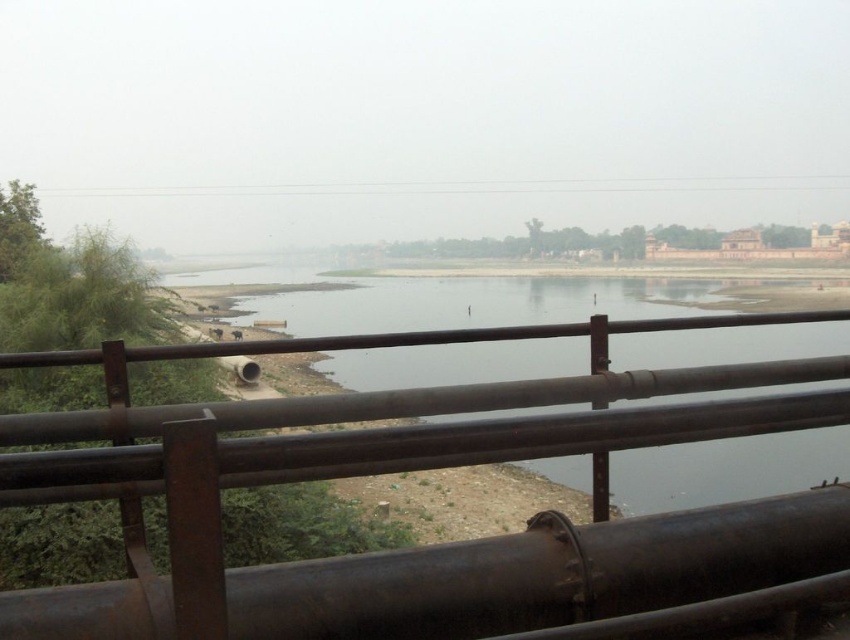
Can you confirm if rusty metal rail at center is positioned above rusty metal water pipe at lower center?

Indeed, rusty metal rail at center is positioned over rusty metal water pipe at lower center.

Between rusty metal rail at center and rusty metal water pipe at lower center, which one appears on the right side from the viewer's perspective?

rusty metal rail at center

You are a GUI agent. You are given a task and a screenshot of the screen. Output one action in this format:
    pyautogui.click(x=<x>, y=<y>)
    Task: Click on the rusty metal rail at center
    The width and height of the screenshot is (850, 640).
    Given the screenshot: What is the action you would take?
    pyautogui.click(x=404, y=468)

Image resolution: width=850 pixels, height=640 pixels. In order to click on rusty metal rail at center in this screenshot , I will do `click(404, 468)`.

Is rusty metal rail at center further to the viewer compared to smooth concrete river at center?

No, rusty metal rail at center is in front of smooth concrete river at center.

The width and height of the screenshot is (850, 640). Describe the element at coordinates (404, 468) in the screenshot. I see `rusty metal rail at center` at that location.

You are a GUI agent. You are given a task and a screenshot of the screen. Output one action in this format:
    pyautogui.click(x=<x>, y=<y>)
    Task: Click on the rusty metal rail at center
    
    Given the screenshot: What is the action you would take?
    pyautogui.click(x=404, y=468)

Which is more to the right, rusty metal water pipe at lower center or smooth concrete river at center?

From the viewer's perspective, smooth concrete river at center appears more on the right side.

Does point (627, 564) lie behind point (775, 452)?

No, (627, 564) is closer to viewer.

Between point (605, 573) and point (803, 435), which one is positioned in front?

Positioned in front is point (605, 573).

Locate an element on the screen. rusty metal water pipe at lower center is located at coordinates (544, 573).